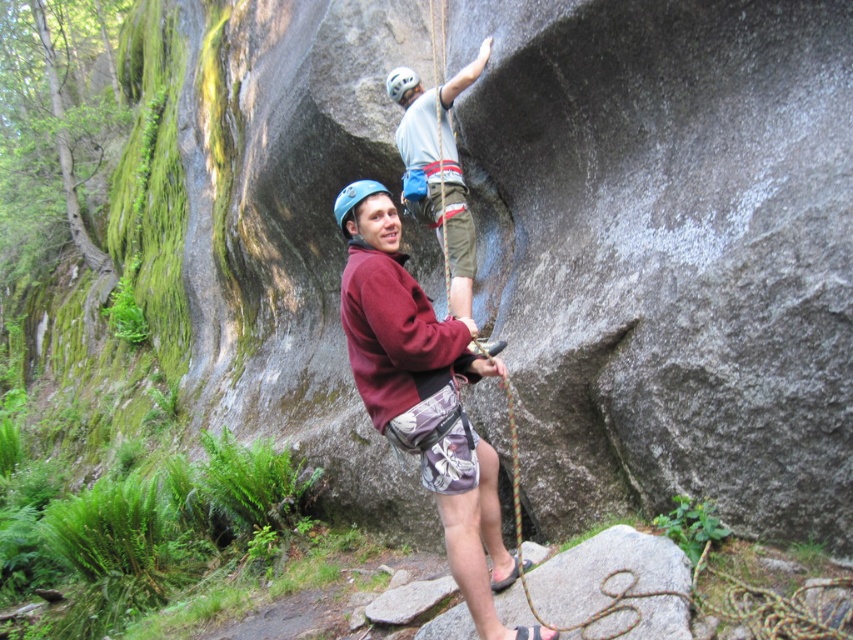
You are a safety inspector assessing the climbing setup. The safety protocol requires that the distance between the climber and the observer must be within 10 feet for effective supervision. Is the current distance between the blue matte helmet at center and the camera within the safety protocol guidelines?

The distance between the blue matte helmet at center and the camera is 9.49 feet, which is within the 10 feet requirement. Therefore, the current setup meets the safety protocol guidelines.

You are a safety inspector assessing the climbing setup. The safety guideline states that the minimum safe distance between two climbers should be at least 30 inches to avoid collisions. Based on the scene, is the current distance between the maroon fleece jacket at center and the blue matte helmet at center compliant with the safety guideline?

The distance between the maroon fleece jacket at center and the blue matte helmet at center is 29.59 inches, which is less than the required 30 inches. Therefore, the current setup does not comply with the safety guideline.